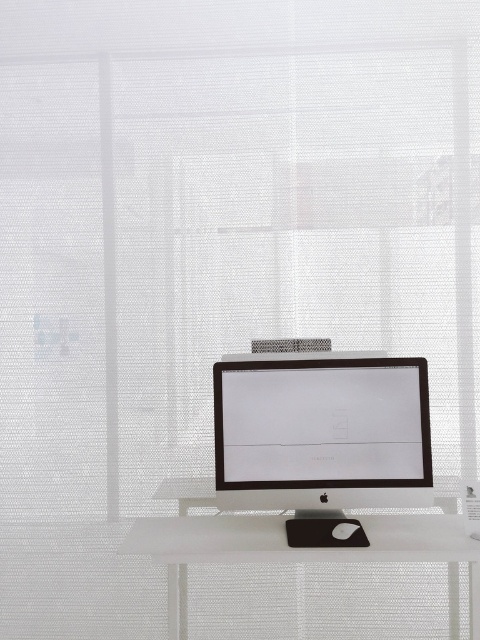
Question: Can you confirm if satin black monitor at center is wider than black plastic mouse at center?

Choices:
 (A) no
 (B) yes

Answer: (B)

Question: Based on their relative distances, which object is nearer to the satin black monitor at center?

Choices:
 (A) black plastic mouse at center
 (B) white matte computer desk at center

Answer: (B)

Question: Which is nearer to the satin black monitor at center?

Choices:
 (A) white matte computer desk at center
 (B) black plastic mouse at center

Answer: (A)

Question: Is satin black monitor at center thinner than black plastic mouse at center?

Choices:
 (A) yes
 (B) no

Answer: (B)

Question: Where is satin black monitor at center located in relation to white matte computer desk at center in the image?

Choices:
 (A) right
 (B) left

Answer: (A)

Question: Which object is positioned farthest from the satin black monitor at center?

Choices:
 (A) black plastic mouse at center
 (B) white matte computer desk at center

Answer: (A)